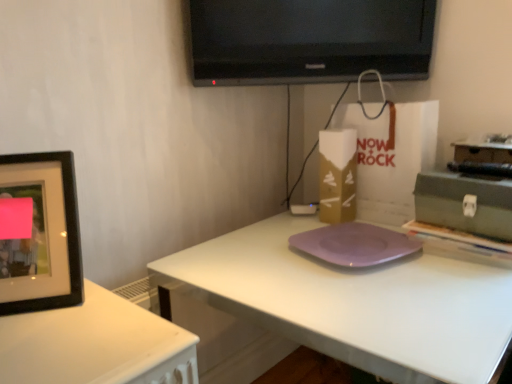
Locate an element on the screen. This screenshot has width=512, height=384. black glossy tv at upper center is located at coordinates (308, 40).

The image size is (512, 384). What do you see at coordinates (465, 203) in the screenshot?
I see `green matte toolbox at right` at bounding box center [465, 203].

Find the location of a particular element. The height and width of the screenshot is (384, 512). purple matte plate at center is located at coordinates (354, 302).

The height and width of the screenshot is (384, 512). What do you see at coordinates (354, 302) in the screenshot? I see `purple matte plate at center` at bounding box center [354, 302].

In order to face gold cardboard box at center, should I rotate leftwards or rightwards?

To face it directly, rotate right by 10.816 degrees.

The image size is (512, 384). I want to click on white paper bag at center, so click(391, 156).

Where is `purple matte pad at center`? The width and height of the screenshot is (512, 384). purple matte pad at center is located at coordinates (355, 244).

From the picture: From a real-world perspective, is black glossy tv at upper center over purple matte plate at center?

Correct, in the physical world, black glossy tv at upper center is higher than purple matte plate at center.

Is black glossy tv at upper center positioned with its back to purple matte plate at center?

No, purple matte plate at center is not at the back of black glossy tv at upper center.

Does black glossy tv at upper center lie behind purple matte plate at center?

Yes, the depth of black glossy tv at upper center is greater than that of purple matte plate at center.

Is black glossy tv at upper center placed right next to purple matte plate at center?

No, black glossy tv at upper center is not in contact with purple matte plate at center.

From the image's perspective, relative to white paper bag at center, is purple matte plate at center above or below?

From the image's perspective, purple matte plate at center appears below white paper bag at center.

Looking at their sizes, would you say purple matte plate at center is wider or thinner than white paper bag at center?

purple matte plate at center is wider than white paper bag at center.

Who is more distant, purple matte plate at center or white paper bag at center?

white paper bag at center is more distant.

Based on their positions, is green matte toolbox at right located to the left or right of purple matte pad at center?

From the image, it's evident that green matte toolbox at right is to the right of purple matte pad at center.

From a real-world perspective, which is physically above, green matte toolbox at right or purple matte pad at center?

From a 3D spatial view, green matte toolbox at right is above.

Which is in front, point (421, 186) or point (359, 251)?

Point (359, 251)

Is the position of white paper bag at center more distant than that of purple matte pad at center?

Yes, it is behind purple matte pad at center.

From a real-world perspective, is white paper bag at center positioned under purple matte pad at center based on gravity?

No, from a real-world perspective, white paper bag at center is not below purple matte pad at center.

Is white paper bag at center inside or outside of purple matte pad at center?

white paper bag at center is not inside purple matte pad at center, it's outside.

Considering the sizes of objects white paper bag at center and purple matte pad at center in the image provided, who is taller, white paper bag at center or purple matte pad at center?

With more height is white paper bag at center.

Visually, is white paper bag at center positioned to the left or to the right of black glossy tv at upper center?

In the image, white paper bag at center appears on the right side of black glossy tv at upper center.

Do you think white paper bag at center is within black glossy tv at upper center, or outside of it?

white paper bag at center is not enclosed by black glossy tv at upper center.

From a real-world perspective, is white paper bag at center below black glossy tv at upper center?

Yes, from a real-world perspective, white paper bag at center is under black glossy tv at upper center.

Is white paper bag at center bigger than black glossy tv at upper center?

Indeed, white paper bag at center has a larger size compared to black glossy tv at upper center.

Is black matte picture frame at left spatially inside gold cardboard box at center, or outside of it?

black matte picture frame at left cannot be found inside gold cardboard box at center.

Between black matte picture frame at left and gold cardboard box at center, which one has less height?

black matte picture frame at left.

Is point (75, 293) positioned before point (355, 167)?

Yes, point (75, 293) is in front of point (355, 167).

Can gold cardboard box at center be found inside green matte toolbox at right?

That's incorrect, gold cardboard box at center is not inside green matte toolbox at right.

Is green matte toolbox at right to the right of gold cardboard box at center from the viewer's perspective?

Correct, you'll find green matte toolbox at right to the right of gold cardboard box at center.

Which object is more forward, green matte toolbox at right or gold cardboard box at center?

green matte toolbox at right is in front.

From the picture: Who is taller, green matte toolbox at right or gold cardboard box at center?

gold cardboard box at center is taller.

I want to click on television behind the purple matte plate at center, so click(308, 40).

Locate an element on the screen. paper bag that appears on the right of purple matte plate at center is located at coordinates (391, 156).

When comparing their distances from purple matte plate at center, does gold cardboard box at center or white paper bag at center seem further?

Among the two, white paper bag at center is located further to purple matte plate at center.

From the image, which object appears to be nearer to black matte picture frame at left, gold cardboard box at center or white paper bag at center?

gold cardboard box at center is closer to black matte picture frame at left.

When comparing their distances from black matte picture frame at left, does green matte toolbox at right or purple matte pad at center seem closer?

Among the two, purple matte pad at center is located nearer to black matte picture frame at left.

Which object lies further to the anchor point purple matte pad at center, black glossy tv at upper center or gold cardboard box at center?

black glossy tv at upper center is positioned further to the anchor purple matte pad at center.

Based on their spatial positions, is white paper bag at center or black matte picture frame at left closer to purple matte pad at center?

white paper bag at center.

Which object lies further to the anchor point purple matte pad at center, white paper bag at center or black glossy tv at upper center?

black glossy tv at upper center is further to purple matte pad at center.

Estimate the real-world distances between objects in this image. Which object is closer to purple matte plate at center, gold cardboard box at center or black glossy tv at upper center?

Based on the image, gold cardboard box at center appears to be nearer to purple matte plate at center.

Considering their positions, is purple matte pad at center positioned further to black matte picture frame at left than white paper bag at center?

Based on the image, white paper bag at center appears to be further to black matte picture frame at left.

Locate an element on the screen. Image resolution: width=512 pixels, height=384 pixels. picture frame between black glossy tv at upper center and purple matte plate at center vertically is located at coordinates (39, 233).

What are the coordinates of `paper bag between black glossy tv at upper center and gold cardboard box at center vertically` in the screenshot? It's located at (391, 156).

Locate an element on the screen. Image resolution: width=512 pixels, height=384 pixels. box that lies between black glossy tv at upper center and purple matte pad at center from top to bottom is located at coordinates (465, 203).

This screenshot has width=512, height=384. Identify the location of television between black matte picture frame at left and purple matte pad at center. (308, 40).